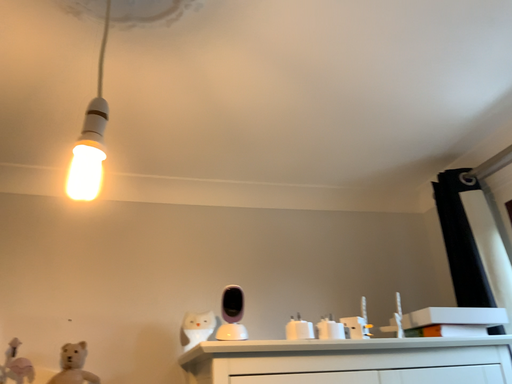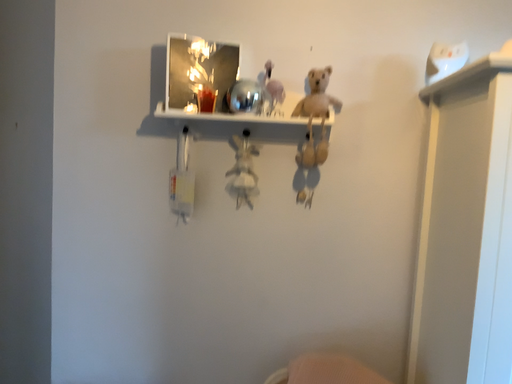
Question: Which way did the camera rotate in the video?

Choices:
 (A) rotated right
 (B) rotated left

Answer: (B)